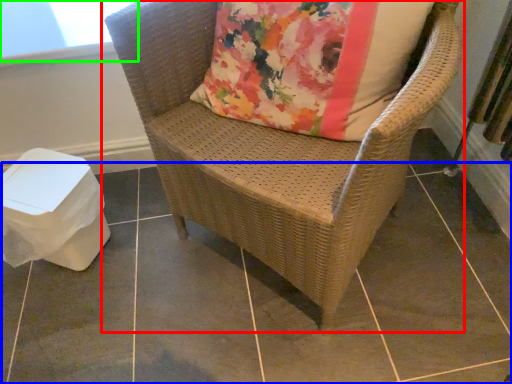
Question: Which object is the closest to the chair (highlighted by a red box)? Choose among these: tile (highlighted by a blue box) or window screen (highlighted by a green box).

Choices:
 (A) tile
 (B) window screen

Answer: (A)